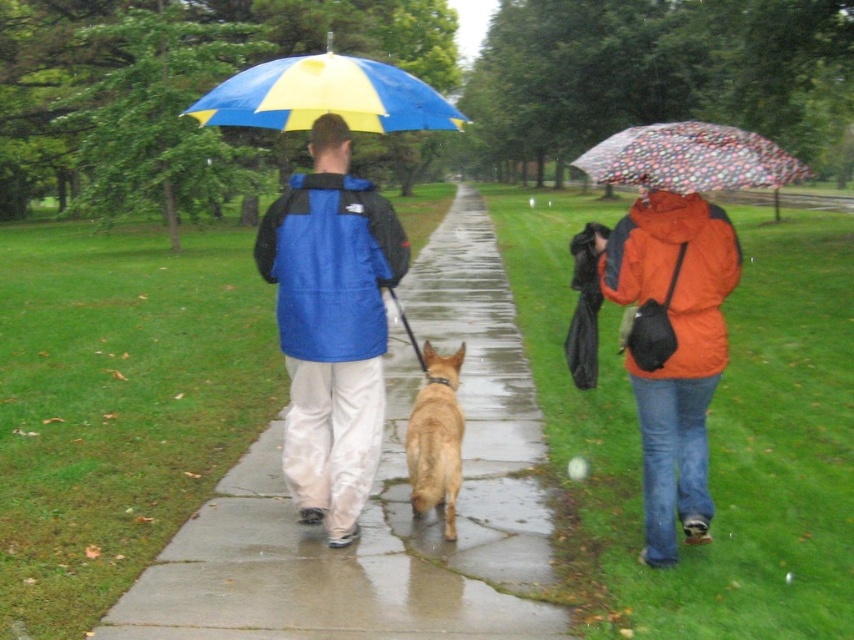
Question: Does concrete sidewalk at center appear over brown fur dog at center?

Choices:
 (A) no
 (B) yes

Answer: (B)

Question: Which point is farther to the camera?

Choices:
 (A) click(168, 547)
 (B) click(295, 321)
 (C) click(454, 397)
 (D) click(276, 60)

Answer: (D)

Question: Is transparent polka dot umbrella at center below brown fur dog at center?

Choices:
 (A) yes
 (B) no

Answer: (B)

Question: Which point is closer to the camera?

Choices:
 (A) concrete sidewalk at center
 (B) blue/yellow striped umbrella at upper center
 (C) brown fur dog at center

Answer: (A)

Question: Is matte blue jacket at center positioned at the back of brown fur dog at center?

Choices:
 (A) no
 (B) yes

Answer: (A)

Question: Estimate the real-world distances between objects in this image. Which object is farther from the concrete sidewalk at center?

Choices:
 (A) brown fur dog at center
 (B) matte blue jacket at center
 (C) transparent polka dot umbrella at center
 (D) blue/yellow striped umbrella at upper center

Answer: (C)